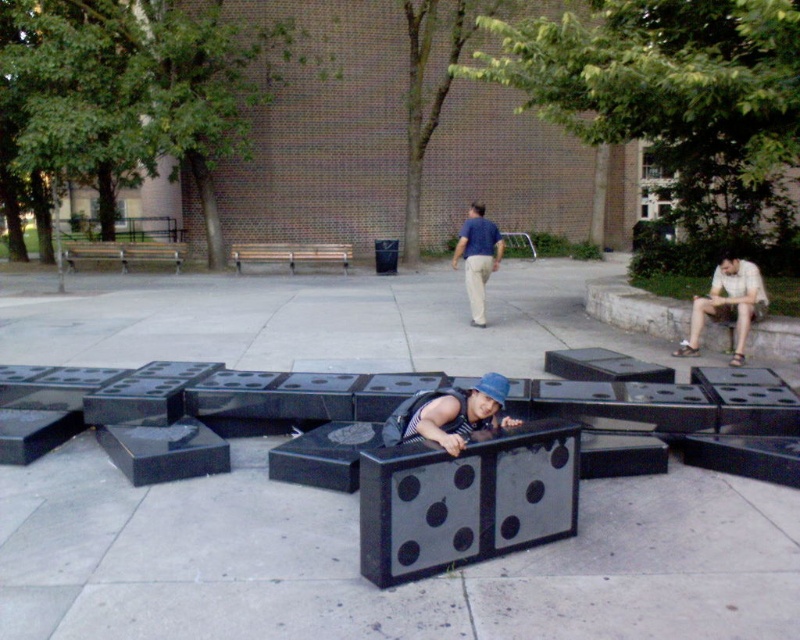
You are standing at the entrance of the plaza and see the matte blue hat at center. If you walk straight ahead, will the hat be in your line of sight before reaching the brick building in the background?

The matte blue hat at center is located at point [450,413], which is in the foreground relative to the brick building in the background. Therefore, the hat will be in your line of sight before reaching the brick building.

You are a maintenance worker needing to move a 3.5 meters long equipment between the wooden bench at left and the wooden bench at center. Can you fit the equipment between them without moving the benches?

The wooden bench at left and wooden bench at center are 5.36 meters apart from each other, so yes, the equipment can be moved between them as the distance is greater than the equipment length.

You are a person standing at the edge of the plaza and want to reach the wooden bench at center. There are black glossy blocks at center in your path. Can you walk around them to get to the bench?

The black glossy blocks at center are in front of the wooden bench at center, so you can walk around them to reach the bench since they are positioned directly in front but not blocking the entire path.